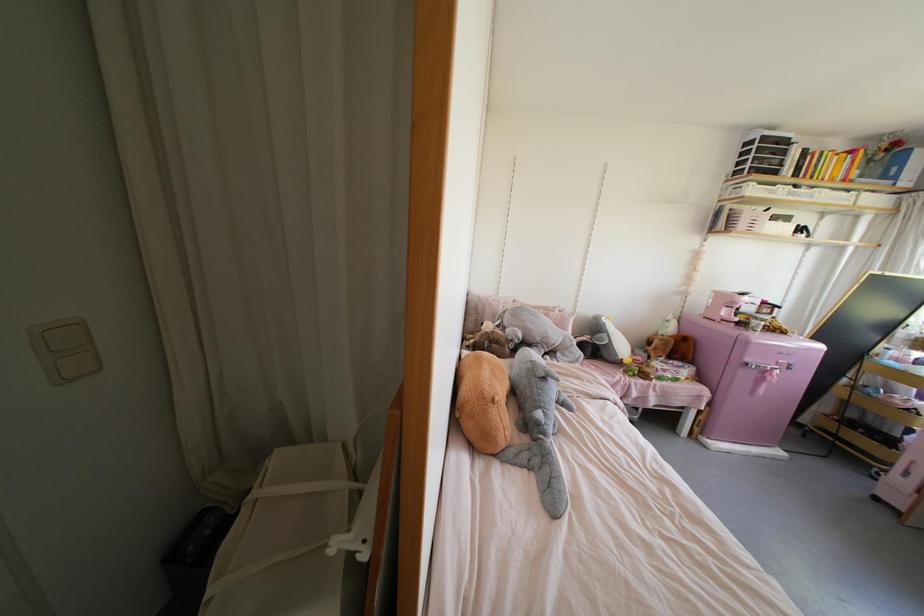
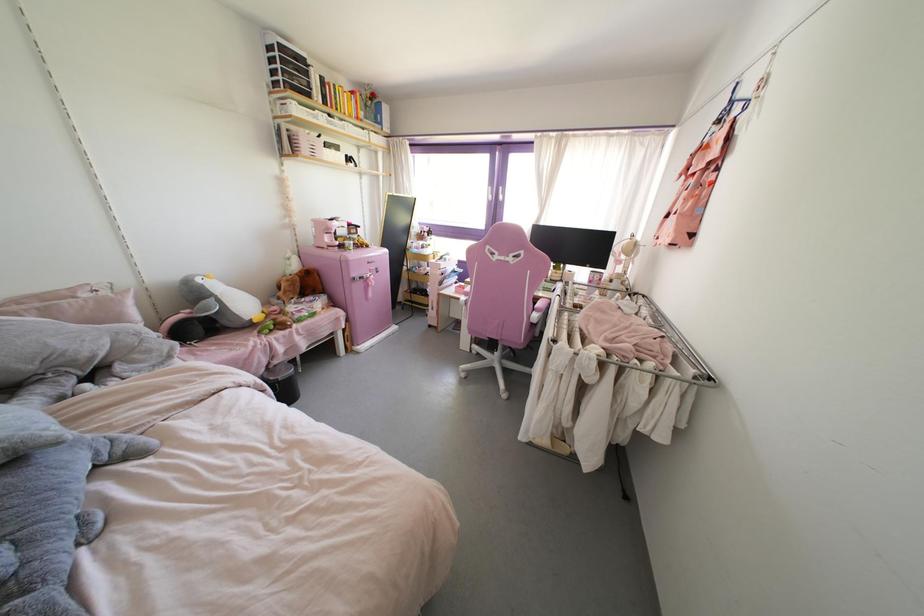
The first image is from the beginning of the video and the second image is from the end. How did the camera likely rotate when shooting the video?

The camera rotated toward right-down.